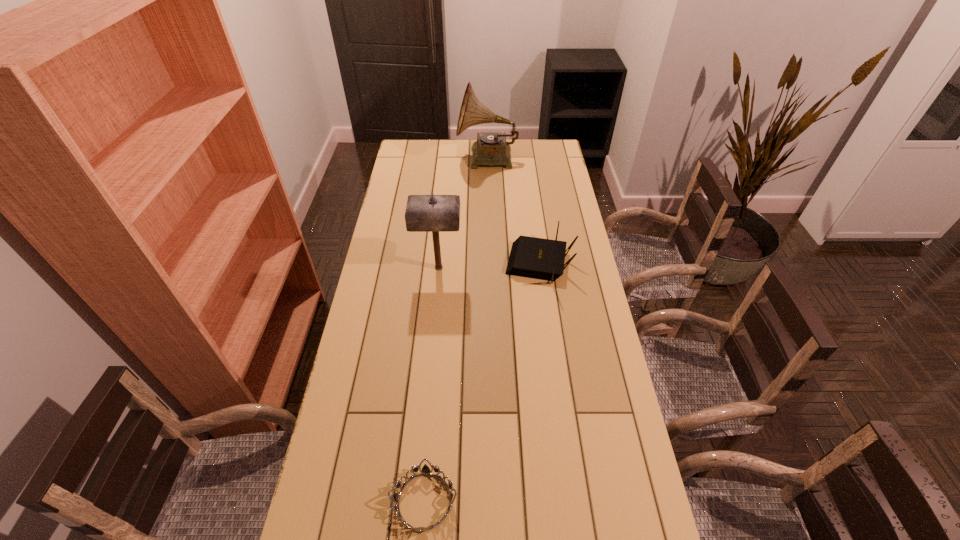
This screenshot has width=960, height=540. Find the location of `the farthest object`. the farthest object is located at coordinates (491, 148).

Identify the location of mallet. This screenshot has height=540, width=960. (432, 213).

Identify the location of the second shortest object. This screenshot has height=540, width=960. (530, 257).

I want to click on the shortest object, so [x=425, y=470].

Where is `tiara`? The image size is (960, 540). tiara is located at coordinates (425, 470).

Where is `vacant area situated from the horn of the farthest object`? vacant area situated from the horn of the farthest object is located at coordinates (410, 159).

Identify the location of vacant area situated from the horn of the farthest object. (412, 159).

Locate an element on the screen. vacant area situated 0.240m from the horn of the farthest object is located at coordinates (408, 159).

This screenshot has width=960, height=540. Identify the location of free space located on the back of the mallet. (444, 205).

Where is `free region located on the front of the third tallest object`? free region located on the front of the third tallest object is located at coordinates (552, 356).